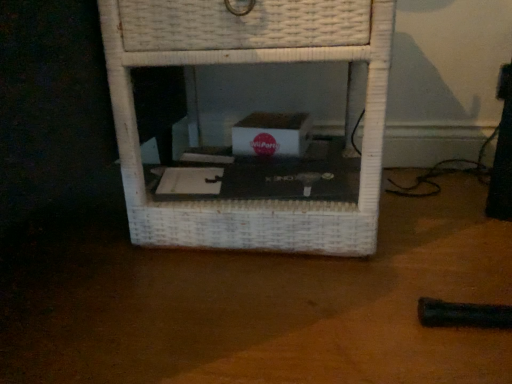
The width and height of the screenshot is (512, 384). Identify the location of vacant space in front of white wicker shelf at center. (249, 305).